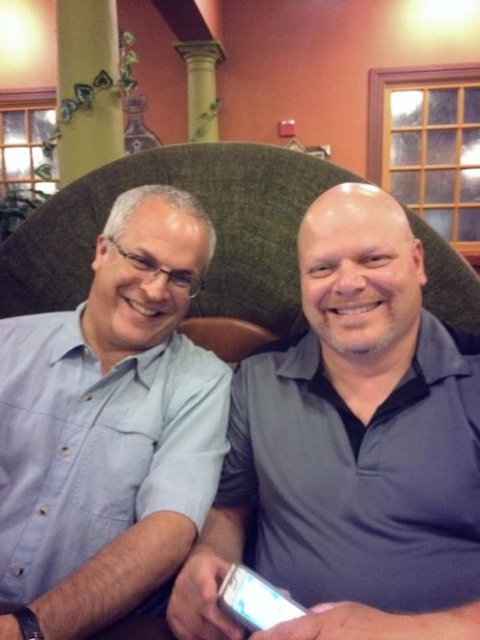
Question: Which object appears closest to the camera in this image?

Choices:
 (A) light blue shirt at center
 (B) gray matte shirt at center

Answer: (B)

Question: Observing the image, what is the correct spatial positioning of light blue shirt at center in reference to gray matte shirt at center?

Choices:
 (A) left
 (B) right

Answer: (A)

Question: Does light blue shirt at center lie in front of gray matte shirt at center?

Choices:
 (A) no
 (B) yes

Answer: (A)

Question: Can you confirm if light blue shirt at center is wider than gray matte shirt at center?

Choices:
 (A) no
 (B) yes

Answer: (A)

Question: Among these points, which one is nearest to the camera?

Choices:
 (A) (361, 342)
 (B) (26, 493)

Answer: (A)